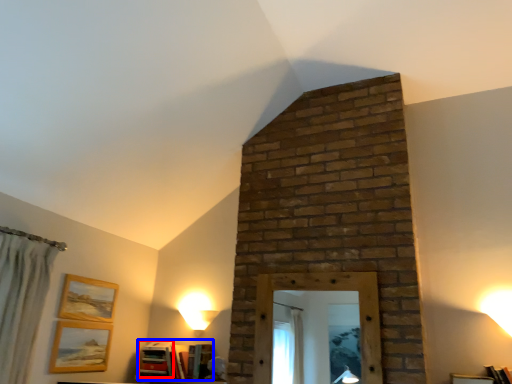
Question: Which of the following is the closest to the observer, book (highlighted by a red box) or book (highlighted by a blue box)?

Choices:
 (A) book
 (B) book

Answer: (B)